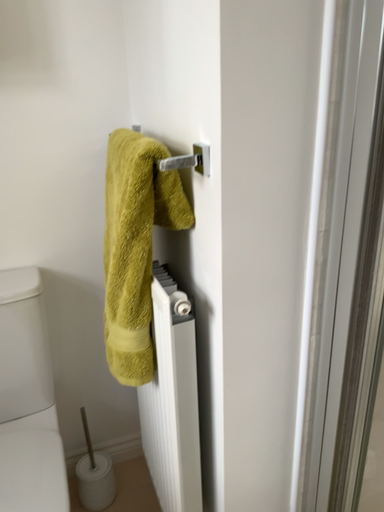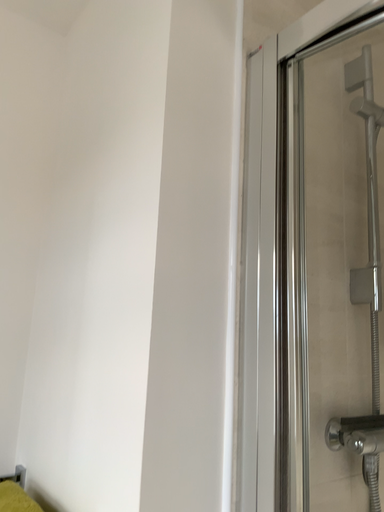
Question: How did the camera likely rotate when shooting the video?

Choices:
 (A) rotated right
 (B) rotated left

Answer: (A)